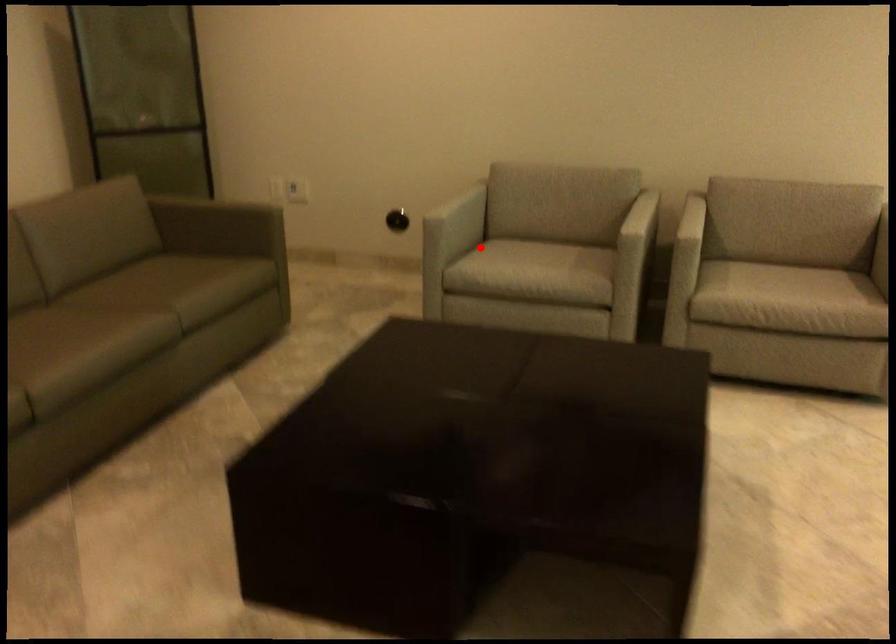
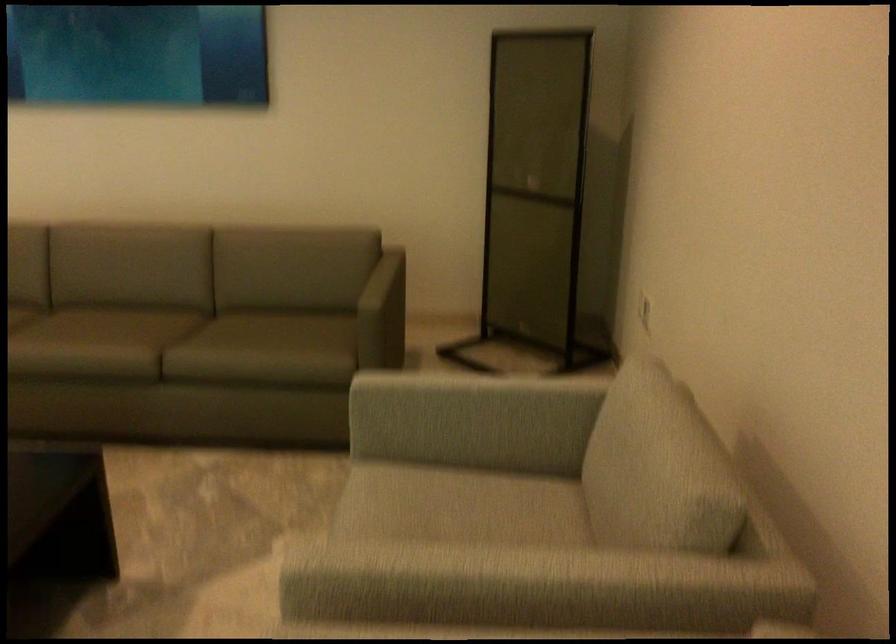
Question: A red point is marked in image1. In image2, is the corresponding 3D point closer to the camera or farther? Reply with the corresponding letter.

Choices:
 (A) The corresponding 3D point is closer.
 (B) The corresponding 3D point is farther.

Answer: (A)